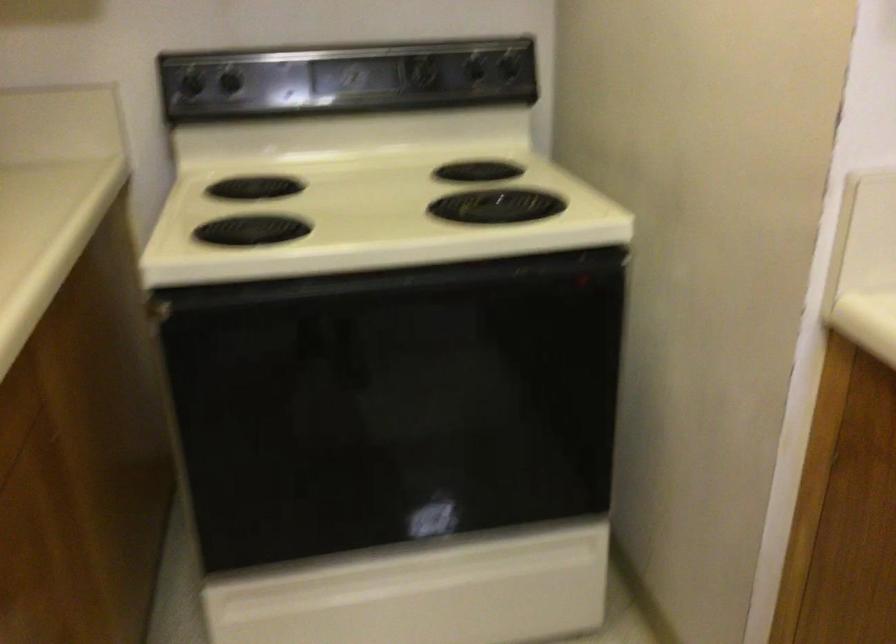
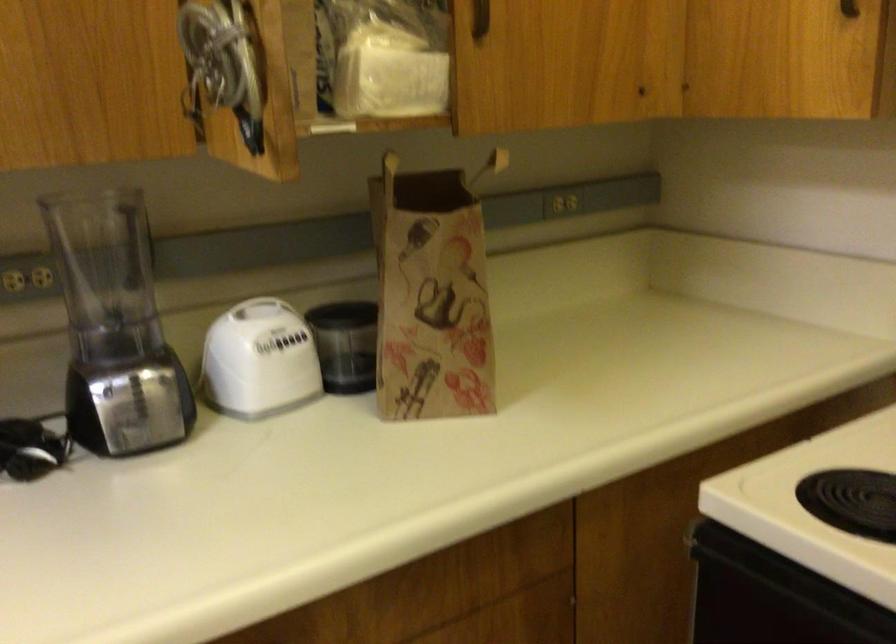
Question: The first image is from the beginning of the video and the second image is from the end. How did the camera likely rotate when shooting the video?

Choices:
 (A) Left
 (B) Right
 (C) Up
 (D) Down

Answer: (A)